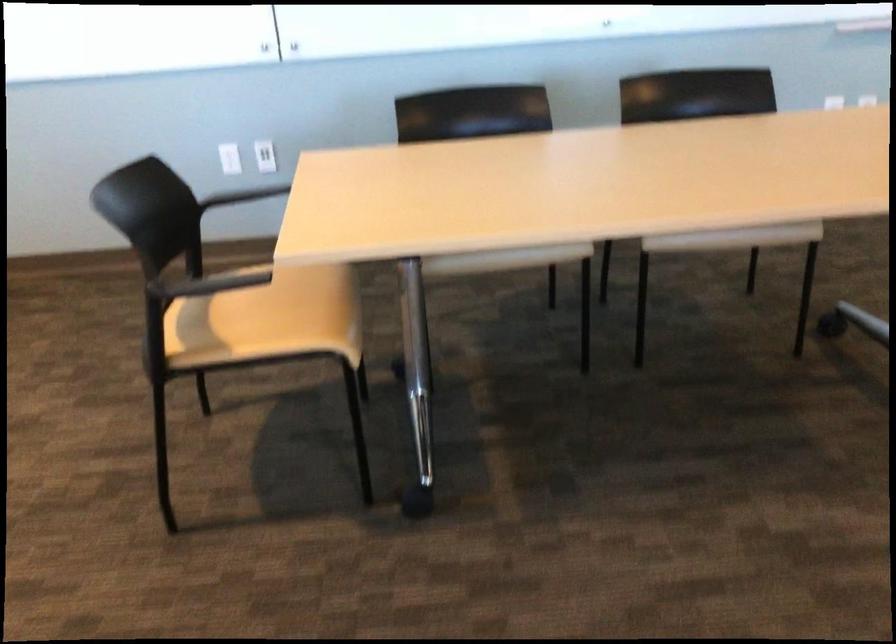
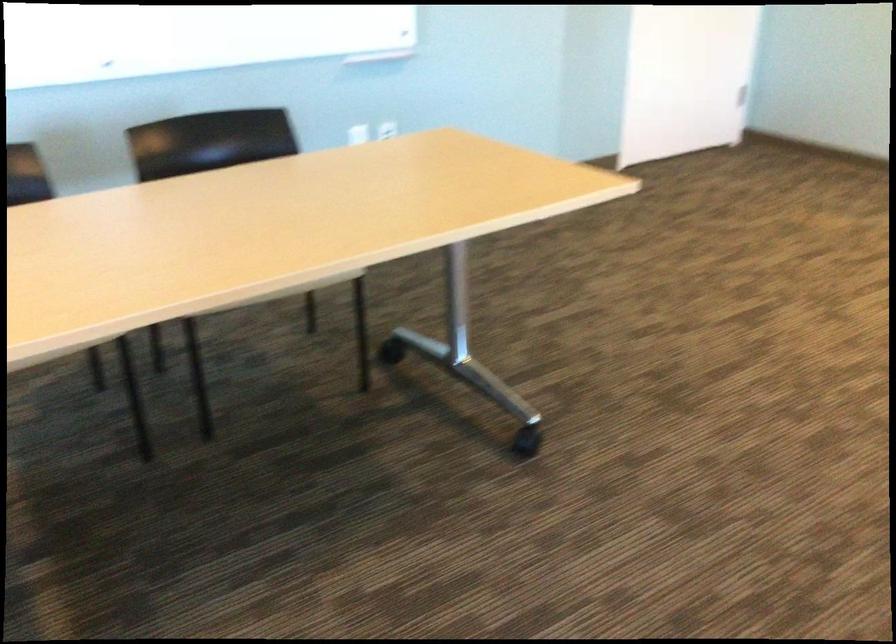
Question: How did the camera likely rotate?

Choices:
 (A) Left
 (B) Right
 (C) Up
 (D) Down

Answer: (B)